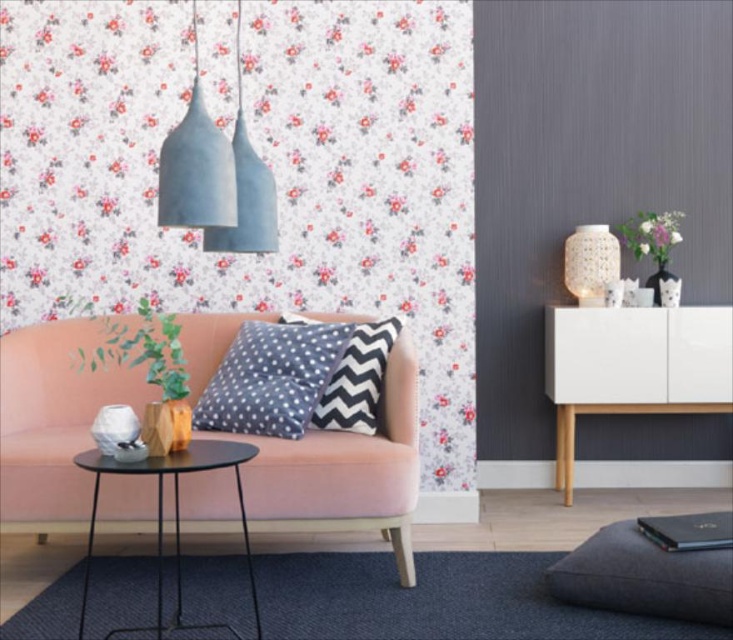
Question: Does polka dot fabric pillow at center appear on the left side of metallic pendant light at upper center?

Choices:
 (A) yes
 (B) no

Answer: (B)

Question: Which of these objects is positioned closest to the black and white zigzag pillow at center?

Choices:
 (A) polka dot fabric pillow at center
 (B) matte concrete pendant light at upper center
 (C) metallic pendant light at upper center
 (D) black metal side table at lower left

Answer: (A)

Question: Does white glossy cabinet at right come in front of matte concrete pendant light at upper center?

Choices:
 (A) no
 (B) yes

Answer: (A)

Question: Can you confirm if white glossy cabinet at right is positioned above black and white zigzag pillow at center?

Choices:
 (A) no
 (B) yes

Answer: (A)

Question: Considering the real-world distances, which object is closest to the white glossy cabinet at right?

Choices:
 (A) matte gray cushion at lower right
 (B) velvet pink couch at center

Answer: (A)

Question: Which point appears closest to the camera in this image?

Choices:
 (A) (317, 529)
 (B) (641, 566)

Answer: (B)